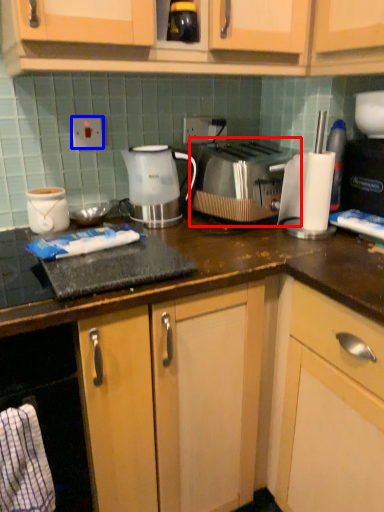
Question: Which object is closer to the camera taking this photo, toaster (highlighted by a red box) or electric outlet (highlighted by a blue box)?

Choices:
 (A) toaster
 (B) electric outlet

Answer: (A)